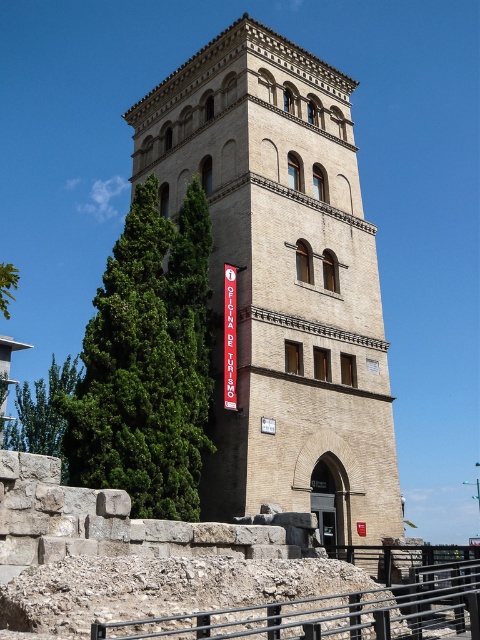
Question: Observing the image, what is the correct spatial positioning of beige brick tower at center in reference to black metal/rail at lower center?

Choices:
 (A) below
 (B) above

Answer: (B)

Question: Does beige brick tower at center appear on the right side of black metal/rail at lower center?

Choices:
 (A) yes
 (B) no

Answer: (B)

Question: Which point is closer to the camera?

Choices:
 (A) (450, 616)
 (B) (359, 477)

Answer: (A)

Question: Does beige brick tower at center come behind black metal/rail at lower center?

Choices:
 (A) no
 (B) yes

Answer: (B)